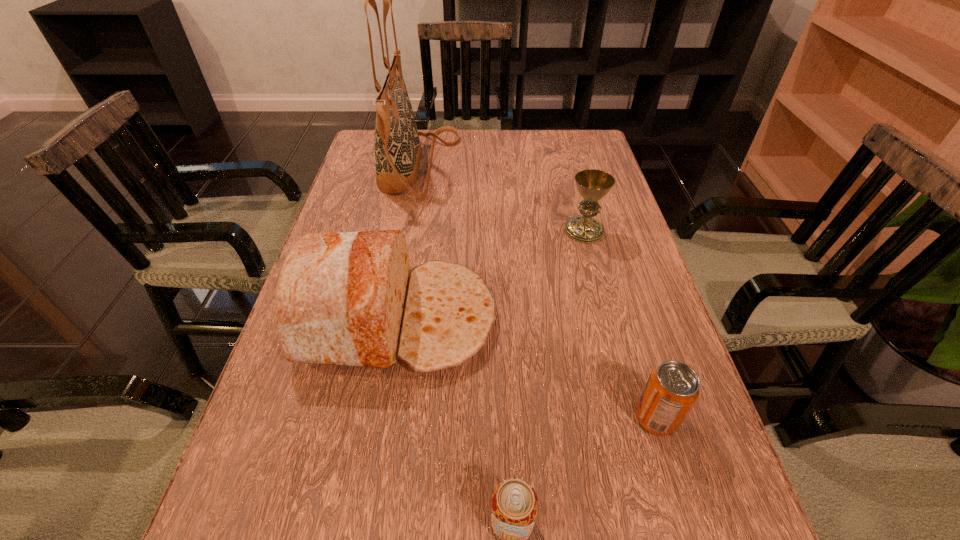
Image resolution: width=960 pixels, height=540 pixels. I want to click on vacant space at the right edge of the desktop, so click(x=606, y=170).

The width and height of the screenshot is (960, 540). In order to click on vacant space at the far left corner of the desktop in this screenshot , I will do `click(361, 148)`.

You are a GUI agent. You are given a task and a screenshot of the screen. Output one action in this format:
    pyautogui.click(x=<x>, y=<y>)
    Task: Click on the free spot at the far right corner of the desktop
    The width and height of the screenshot is (960, 540).
    Given the screenshot: What is the action you would take?
    pyautogui.click(x=598, y=150)

Where is `free spot between the fourth farthest object and the farthest object`? This screenshot has width=960, height=540. free spot between the fourth farthest object and the farthest object is located at coordinates (538, 292).

What are the coordinates of `free space that is in between the tallest object and the second farthest object` in the screenshot? It's located at pos(502,199).

This screenshot has width=960, height=540. I want to click on free area in between the handbag and the chalice, so click(x=502, y=199).

Identify the location of vacant area between the handbag and the bread. (408, 243).

I want to click on free space that is in between the fourth farthest object and the chalice, so click(x=620, y=325).

Locate an element on the screen. The width and height of the screenshot is (960, 540). object that is the closest one to the second farthest object is located at coordinates (348, 298).

You are a GUI agent. You are given a task and a screenshot of the screen. Output one action in this format:
    pyautogui.click(x=<x>, y=<y>)
    Task: Click on the object that is the third nearest to the third nearest object
    The width and height of the screenshot is (960, 540).
    Given the screenshot: What is the action you would take?
    pyautogui.click(x=398, y=151)